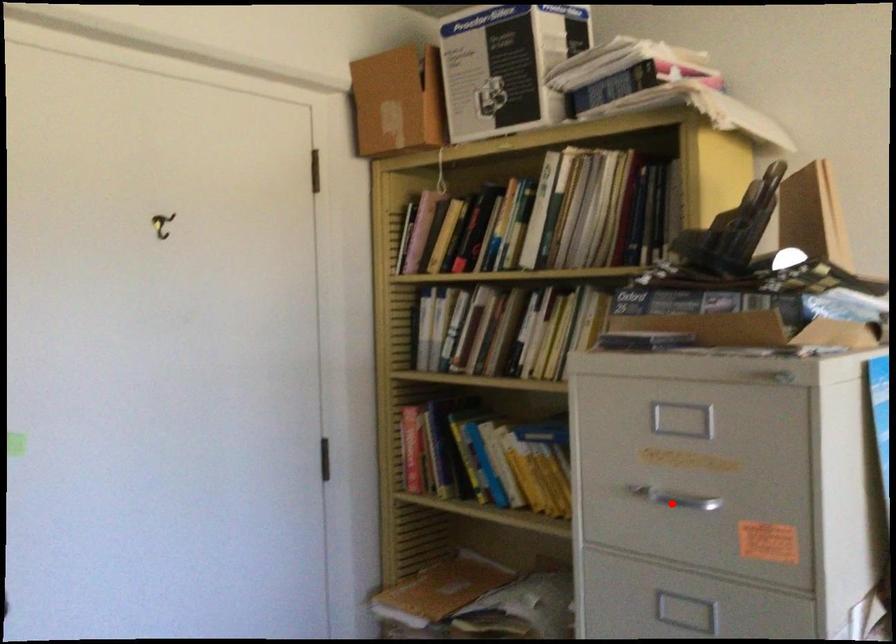
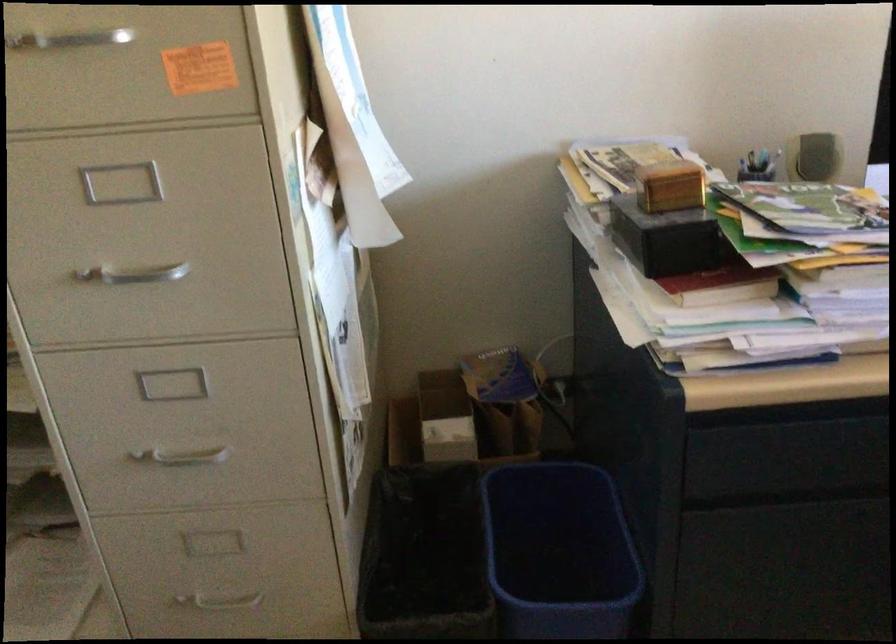
The point at the highlighted location is marked in the first image. Where is the corresponding point in the second image?

(67, 40)